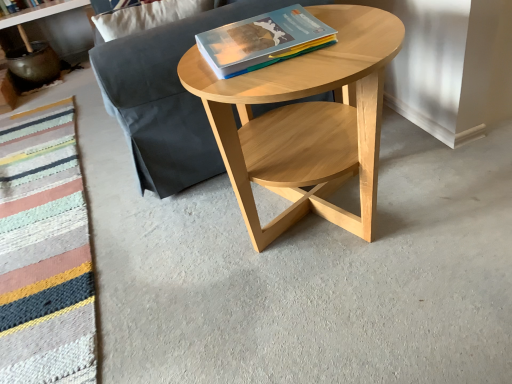
Locate an element on the screen. The image size is (512, 384). free space in front of natural wood coffee table at center is located at coordinates (359, 317).